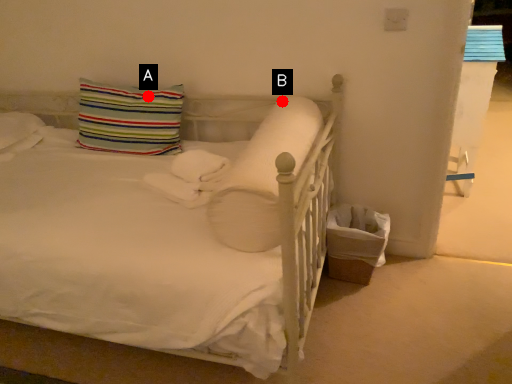
Question: Two points are circled on the image, labeled by A and B beside each circle. Which point is further to the camera?

Choices:
 (A) A is further
 (B) B is further

Answer: (A)